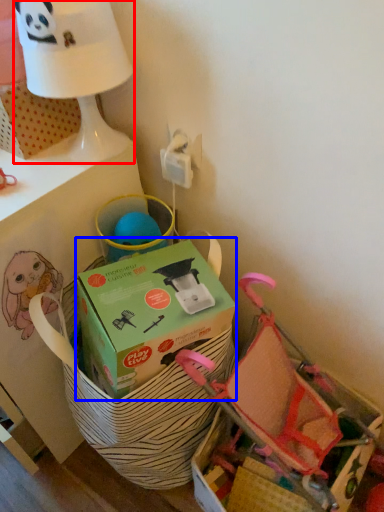
Question: Among these objects, which one is farthest to the camera, table lamp (highlighted by a red box) or box (highlighted by a blue box)?

Choices:
 (A) table lamp
 (B) box

Answer: (A)